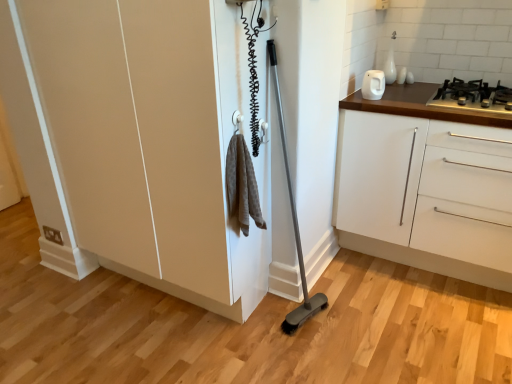
Identify the location of vacant space in front of white glossy kettle at upper right. (386, 109).